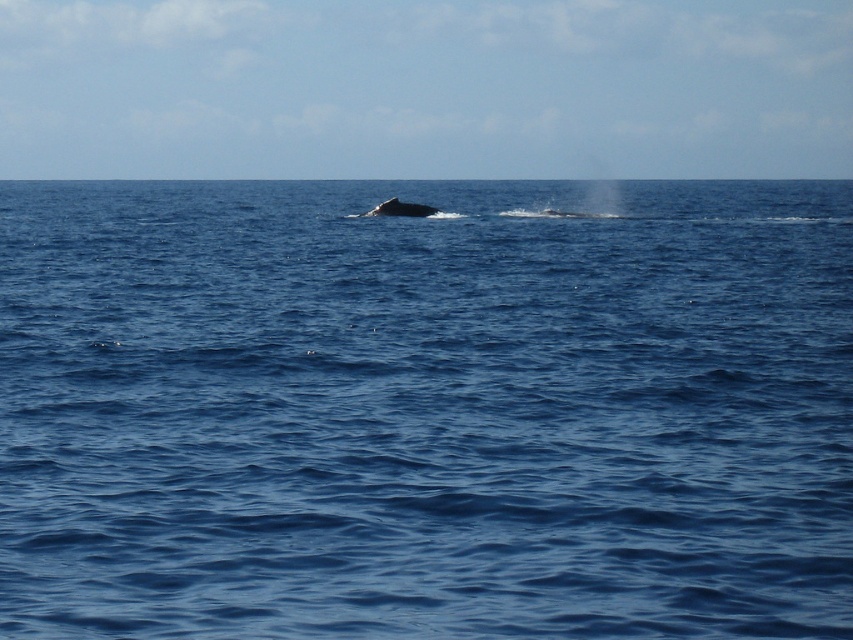
Question: Which point is closer to the camera?

Choices:
 (A) gray matte whale at center
 (B) blue water at center

Answer: (B)

Question: In this image, where is blue water at center located relative to gray matte whale at center?

Choices:
 (A) below
 (B) above

Answer: (B)

Question: Which object appears closest to the camera in this image?

Choices:
 (A) blue water at center
 (B) gray matte whale at center

Answer: (A)

Question: Is blue water at center below gray matte whale at center?

Choices:
 (A) no
 (B) yes

Answer: (A)

Question: Does blue water at center have a smaller size compared to gray matte whale at center?

Choices:
 (A) no
 (B) yes

Answer: (A)